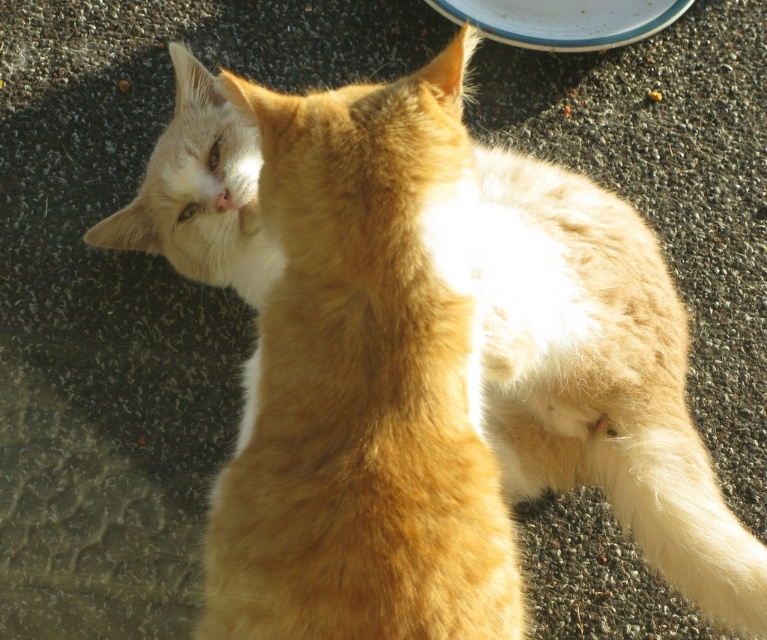
You are a photographer trying to capture a closeup of the white fluffy tail at lower right without the white glossy plate at upper center blocking the view. Is this possible based on their positions?

The white fluffy tail at lower right is closer to the viewer than the white glossy plate at upper center, so you can capture a closeup of the white fluffy tail at lower right without the white glossy plate at upper center blocking the view since it is farther away.